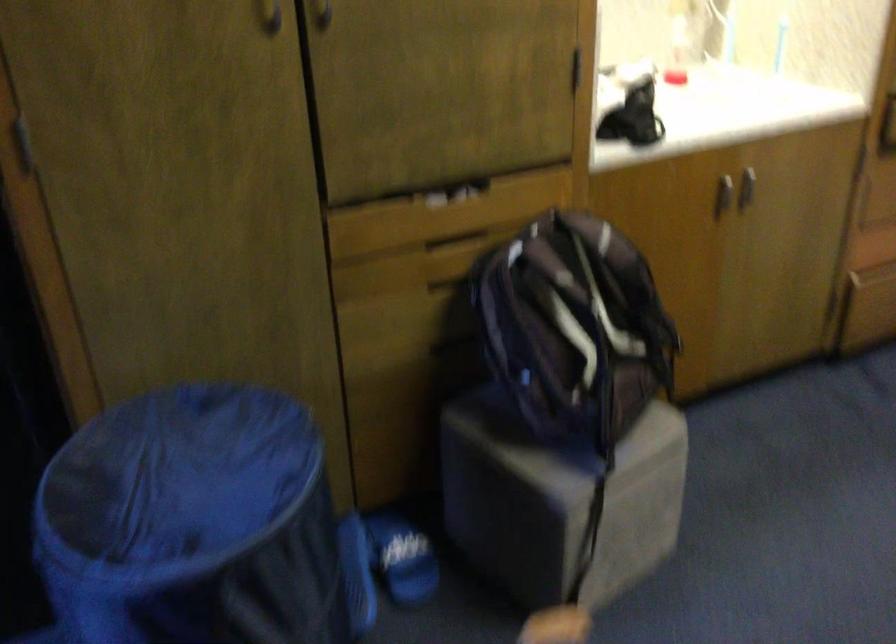
Find where to sit the stool sitting surface. Please return your answer as a coordinate pair (x, y).

(556, 442)